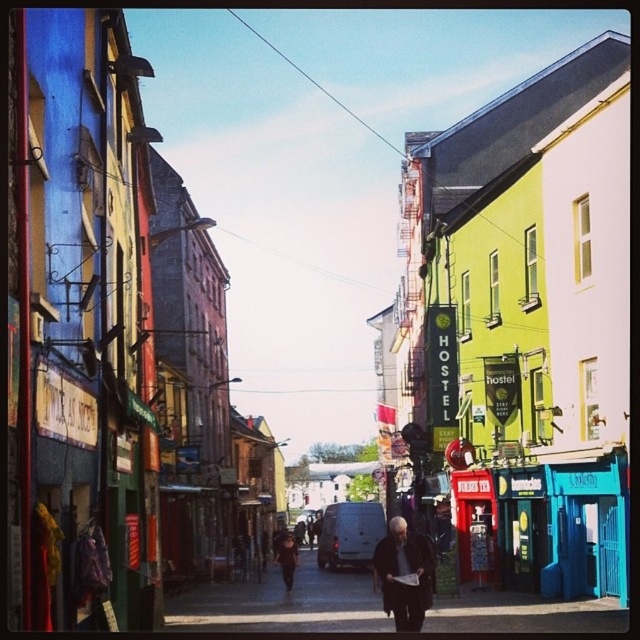
Question: Which object is farther from the camera taking this photo?

Choices:
 (A) smooth asphalt road at center
 (B) dark brown leather jacket at center

Answer: (A)

Question: Is smooth asphalt road at center bigger than dark brown leather jacket at center?

Choices:
 (A) yes
 (B) no

Answer: (A)

Question: Which of the following is the closest to the observer?

Choices:
 (A) (429, 582)
 (B) (186, 596)

Answer: (A)

Question: Is the position of smooth asphalt road at center more distant than that of dark brown leather jacket at center?

Choices:
 (A) yes
 (B) no

Answer: (A)

Question: Does smooth asphalt road at center come behind dark brown leather jacket at center?

Choices:
 (A) yes
 (B) no

Answer: (A)